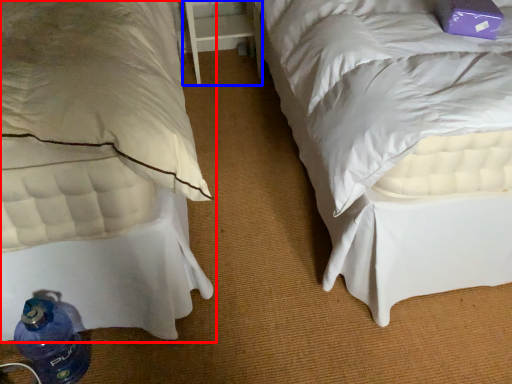
Question: Which object is closer to the camera taking this photo, bed (highlighted by a red box) or table (highlighted by a blue box)?

Choices:
 (A) bed
 (B) table

Answer: (A)